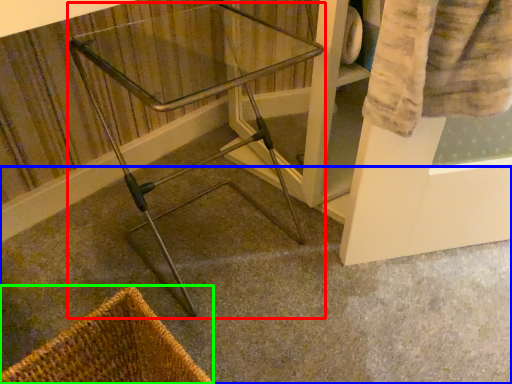
Question: Which object is positioned farthest from furniture (highlighted by a red box)? Select from concrete (highlighted by a blue box) and basket (highlighted by a green box).

Choices:
 (A) concrete
 (B) basket

Answer: (B)